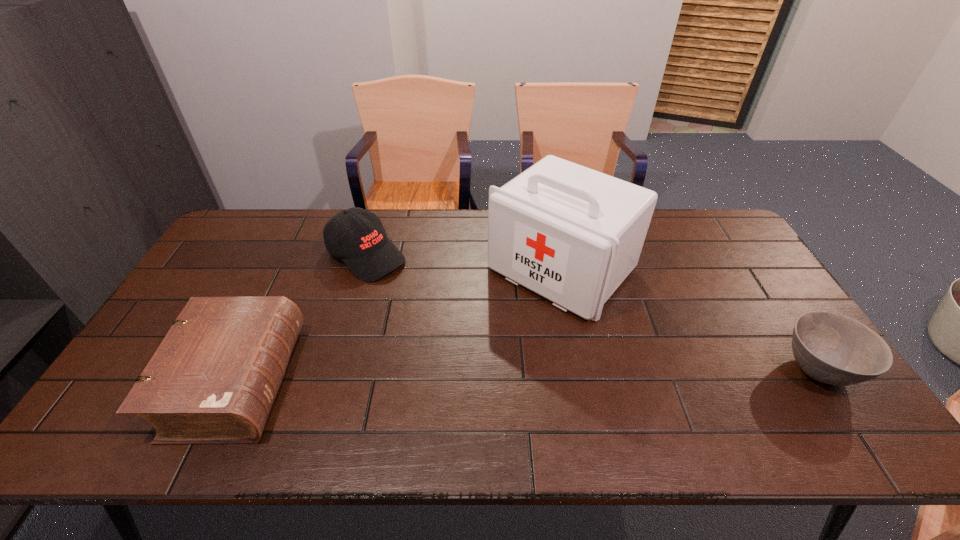
Find the location of a particular element. Image resolution: width=960 pixels, height=540 pixels. free space on the desktop that is between the Bible and the bowl and is positioned on the front-facing side of the baseball cap is located at coordinates (538, 375).

Locate an element on the screen. The height and width of the screenshot is (540, 960). vacant space on the desktop that is between the Bible and the bowl and is positioned on the front-facing side of the tallest object is located at coordinates (453, 377).